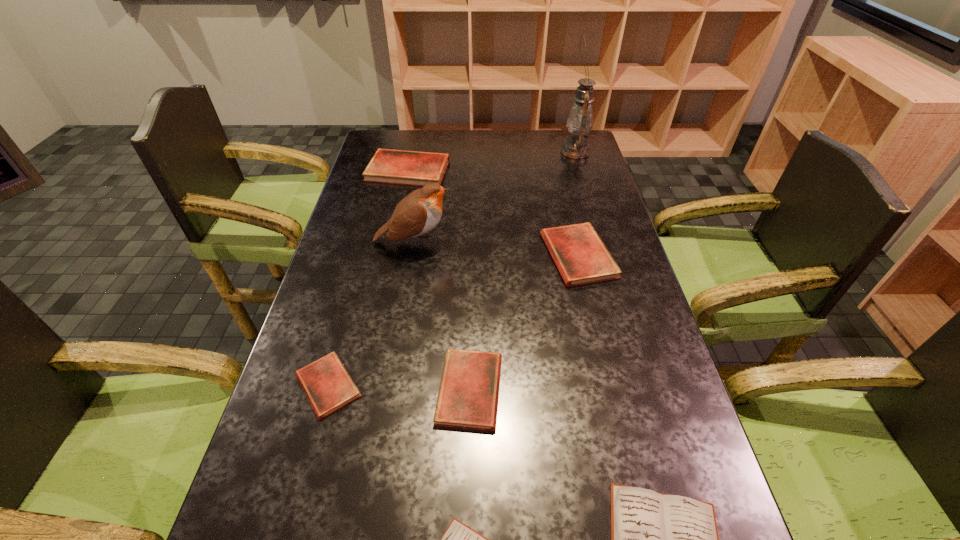
Where is `the tallest object`? the tallest object is located at coordinates (580, 120).

This screenshot has height=540, width=960. Find the location of `brown bird`. brown bird is located at coordinates (418, 213).

At what (x,y) coordinates should I click in order to perform the action: click on bird. Please return your answer as a coordinate pair (x, y). The height and width of the screenshot is (540, 960). Looking at the image, I should click on (418, 213).

At what (x,y) coordinates should I click in order to perform the action: click on the biggest red diary. Please return your answer as a coordinate pair (x, y). This screenshot has height=540, width=960. Looking at the image, I should click on (415, 168).

The width and height of the screenshot is (960, 540). I want to click on the farthest diary, so click(415, 168).

You are a GUI agent. You are given a task and a screenshot of the screen. Output one action in this format:
    pyautogui.click(x=<x>, y=<y>)
    Task: Click on the third nearest red diary
    
    Given the screenshot: What is the action you would take?
    pyautogui.click(x=581, y=257)

Image resolution: width=960 pixels, height=540 pixels. In order to click on the fifth nearest diary in this screenshot , I will do `click(581, 257)`.

You are a GUI agent. You are given a task and a screenshot of the screen. Output one action in this format:
    pyautogui.click(x=<x>, y=<y>)
    Task: Click on the third biggest red diary
    This screenshot has height=540, width=960.
    Given the screenshot: What is the action you would take?
    pyautogui.click(x=468, y=394)

The image size is (960, 540). What are the coordinates of `the smallest red diary` in the screenshot? It's located at (328, 386).

Where is `blank space located on the front of the oil lamp`? The width and height of the screenshot is (960, 540). blank space located on the front of the oil lamp is located at coordinates (587, 187).